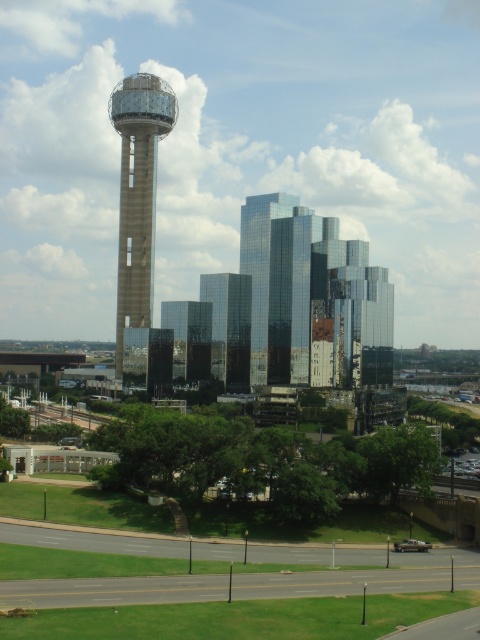
You are a drone operator who needs to fly a drone between the stone tower at center and the glassy reflective skyscraper at center. The drone has a maximum flight distance of 35 meters. Can the drone safely make the trip without exceeding its range?

The distance between the stone tower at center and the glassy reflective skyscraper at center is 36.35 meters, which exceeds the drone operator stated maximum flight distance of 35 meters. Therefore, the drone cannot safely make the trip without exceeding its range.

You are a drone operator who needs to fly a drone between the stone tower at center and the shiny glass skyscraper at center. The drone has a maximum flight distance of 40 meters. Can the drone safely fly between them without exceeding its range?

The stone tower at center is 38.21 meters from the shiny glass skyscraper at center. Since the drone has a maximum flight distance of 40 meters, it can safely fly between them as the distance is within the drone s range.

Based on the provided scene description, where is the shiny glass skyscraper at center located in terms of coordinates?

The shiny glass skyscraper at center is located at coordinates point (260, 268).